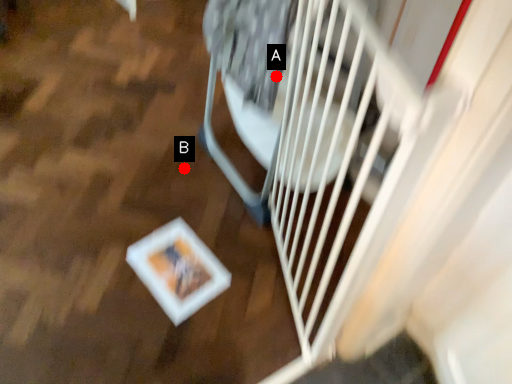
Question: Two points are circled on the image, labeled by A and B beside each circle. Among these points, which one is nearest to the camera?

Choices:
 (A) A is closer
 (B) B is closer

Answer: (A)